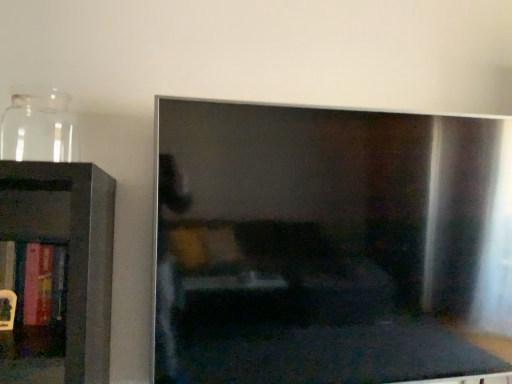
The image size is (512, 384). Find the location of `hardcover book at left`. hardcover book at left is located at coordinates (32, 284).

In order to face hardcover book at left, should I rotate leftwards or rightwards?

A 26.597 degree turn to the left will do.

What do you see at coordinates (32, 284) in the screenshot? I see `hardcover book at left` at bounding box center [32, 284].

The height and width of the screenshot is (384, 512). In order to click on transparent glass jar at left in this screenshot , I will do `click(39, 127)`.

In order to face transparent glass jar at left, should I rotate leftwards or rightwards?

Turn left approximately 26.489 degrees to face it.

Image resolution: width=512 pixels, height=384 pixels. What do you see at coordinates (39, 127) in the screenshot?
I see `transparent glass jar at left` at bounding box center [39, 127].

Locate an element on the screen. The image size is (512, 384). hardcover book at left is located at coordinates pyautogui.click(x=32, y=284).

Considering the relative positions of hardcover book at left and transparent glass jar at left in the image provided, is hardcover book at left to the right of transparent glass jar at left from the viewer's perspective?

No.

Considering the relative positions of hardcover book at left and transparent glass jar at left in the image provided, is hardcover book at left behind transparent glass jar at left?

Yes.

Is point (14, 303) farther from camera compared to point (46, 100)?

That is False.

From the image's perspective, is hardcover book at left above or below transparent glass jar at left?

hardcover book at left is below transparent glass jar at left.

From a real-world perspective, who is located lower, hardcover book at left or transparent glass jar at left?

hardcover book at left.

Which of these two, hardcover book at left or transparent glass jar at left, is thinner?

hardcover book at left is thinner.

Who is shorter, hardcover book at left or transparent glass jar at left?

transparent glass jar at left.

In the scene shown: In terms of size, does hardcover book at left appear bigger or smaller than transparent glass jar at left?

Clearly, hardcover book at left is larger in size than transparent glass jar at left.

Is transparent glass jar at left completely or partially inside hardcover book at left?

No, transparent glass jar at left is not surrounded by hardcover book at left.

Is the surface of hardcover book at left in direct contact with transparent glass jar at left?

No, hardcover book at left is not with transparent glass jar at left.

Is transparent glass jar at left at the back of hardcover book at left?

No, hardcover book at left is not facing the opposite direction of transparent glass jar at left.

This screenshot has width=512, height=384. Identify the location of book behind the transparent glass jar at left. (32, 284).

Between transparent glass jar at left and hardcover book at left, which one appears on the right side from the viewer's perspective?

transparent glass jar at left.

Which is behind, transparent glass jar at left or hardcover book at left?

Positioned behind is hardcover book at left.

Which is in front, point (62, 148) or point (45, 320)?

The point (45, 320) is more forward.

From the image's perspective, who appears lower, transparent glass jar at left or hardcover book at left?

hardcover book at left is shown below in the image.

From a real-world perspective, relative to hardcover book at left, is transparent glass jar at left vertically above or below?

From a real-world perspective, transparent glass jar at left is physically above hardcover book at left.

Can you confirm if transparent glass jar at left is wider than hardcover book at left?

Indeed, transparent glass jar at left has a greater width compared to hardcover book at left.

From the picture: Is transparent glass jar at left taller than hardcover book at left?

In fact, transparent glass jar at left may be shorter than hardcover book at left.

Can you confirm if transparent glass jar at left is smaller than hardcover book at left?

Indeed, transparent glass jar at left has a smaller size compared to hardcover book at left.

Is transparent glass jar at left positioned beyond the bounds of hardcover book at left?

Yes, transparent glass jar at left is located beyond the bounds of hardcover book at left.

Is transparent glass jar at left positioned far away from hardcover book at left?

transparent glass jar at left is actually quite close to hardcover book at left.

Is transparent glass jar at left looking in the opposite direction of hardcover book at left?

No.

From the picture: How much distance is there between transparent glass jar at left and hardcover book at left?

The distance of transparent glass jar at left from hardcover book at left is 12.91 inches.

This screenshot has width=512, height=384. I want to click on glass vase in front of the hardcover book at left, so click(39, 127).

What are the coordinates of `book on the left of transparent glass jar at left` in the screenshot? It's located at (32, 284).

Find the location of `book that is under the transparent glass jar at left (from a real-world perspective)`. book that is under the transparent glass jar at left (from a real-world perspective) is located at coordinates (32, 284).